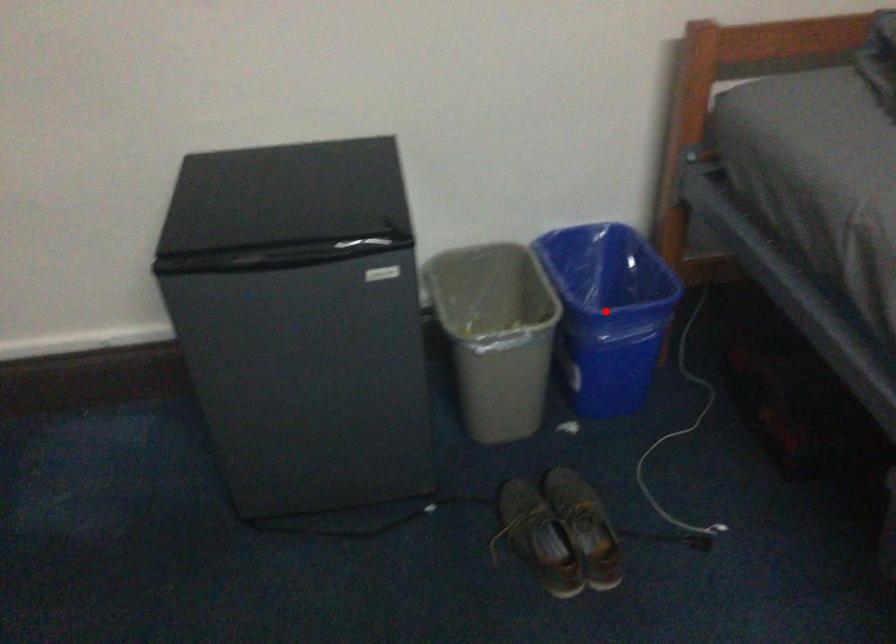
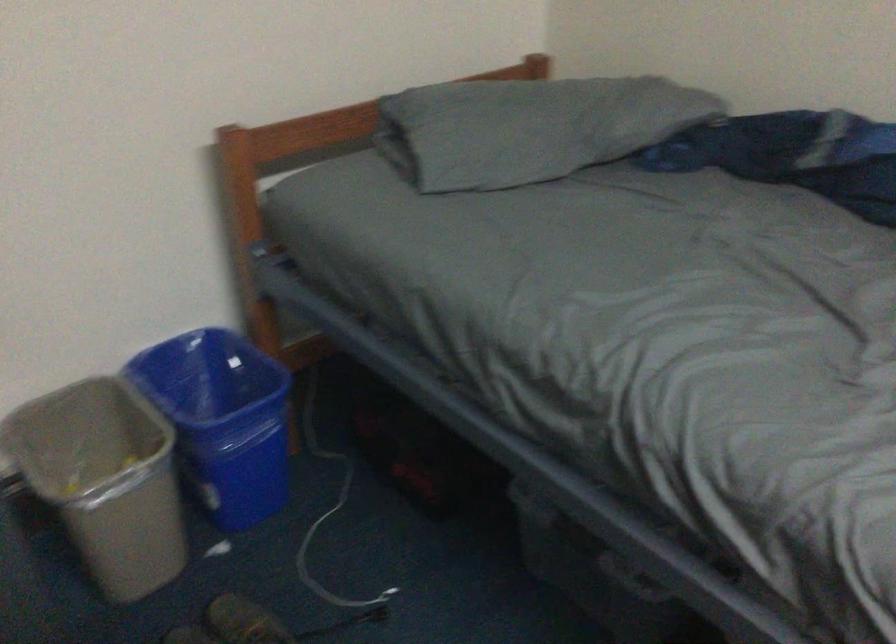
The point at the highlighted location is marked in the first image. Where is the corresponding point in the second image?

(221, 420)